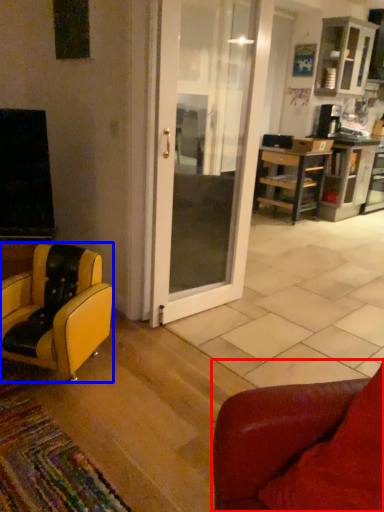
Question: Which object appears farthest to the camera in this image, chair (highlighted by a red box) or chair (highlighted by a blue box)?

Choices:
 (A) chair
 (B) chair

Answer: (B)